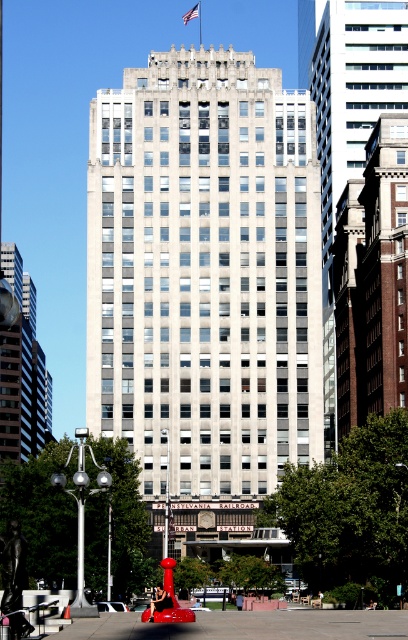
Question: Which of the following is the closest to the observer?

Choices:
 (A) (33, 316)
 (B) (192, 17)

Answer: (A)

Question: Can you confirm if white glass building at center is bigger than red fabric flag at upper center?

Choices:
 (A) no
 (B) yes

Answer: (B)

Question: Is white glass building at center thinner than glassy reflective tower at left?

Choices:
 (A) yes
 (B) no

Answer: (B)

Question: Observing the image, what is the correct spatial positioning of white glass building at center in reference to red fabric flag at upper center?

Choices:
 (A) left
 (B) right

Answer: (A)

Question: Which point is farther to the camera?

Choices:
 (A) white glass building at center
 (B) red fabric flag at upper center

Answer: (B)

Question: Which object is closer to the camera taking this photo?

Choices:
 (A) red plastic traffic cone at center
 (B) white glass building at center
 (C) red fabric flag at upper center

Answer: (A)